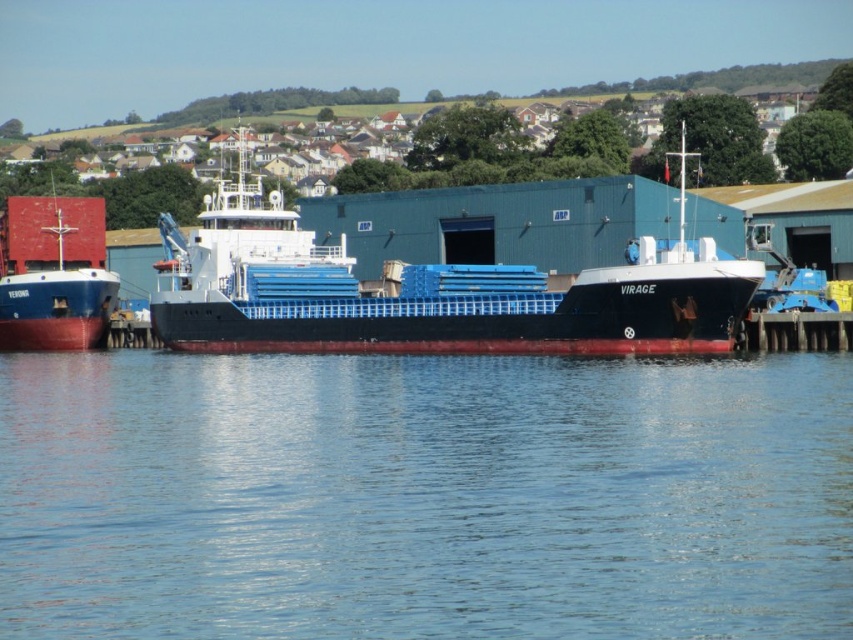
You are a sailor observing the port from the shore. You notice the transparent blue water at center and the blue matte cargo ship at center. Which one is lower in height?

The transparent blue water at center has a lesser height compared to the blue matte cargo ship at center, so the transparent blue water at center is lower in height.

You are a port inspector standing on the dock. You need to board the blue matte cargo ship at center and the matte red ship at left for inspection. Which ship should you board first if you want to follow the standard inspection protocol of starting with the vessel closest to the dock?

The matte red ship at left is closer to the dock than the blue matte cargo ship at center, so you should board the matte red ship at left first.

You are a harbor inspector checking the docking positions of two ships. You see the transparent blue water at center and the matte red ship at left. Which object is located to the right of the other?

The transparent blue water at center is positioned on the right side of the matte red ship at left, so the transparent blue water at center is to the right of the matte red ship at left.